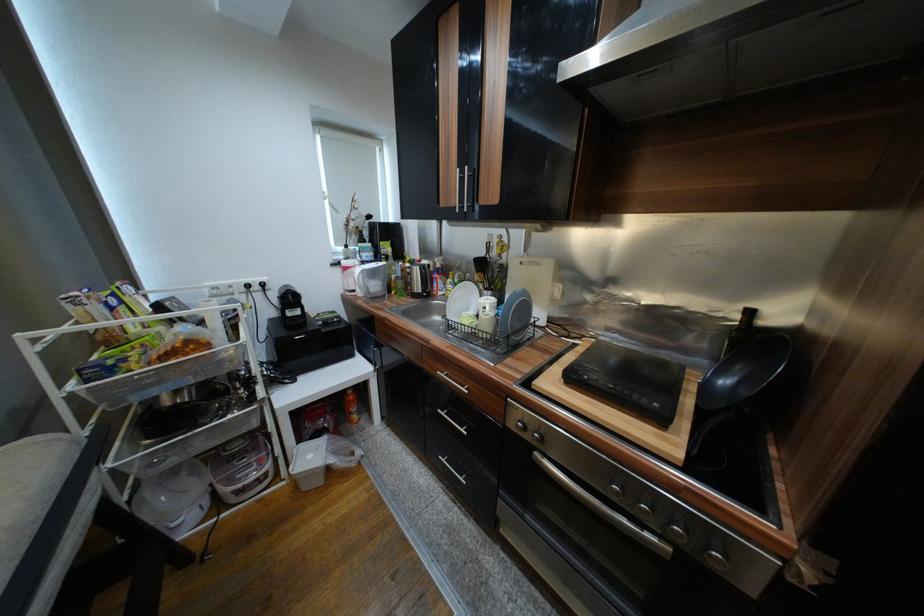
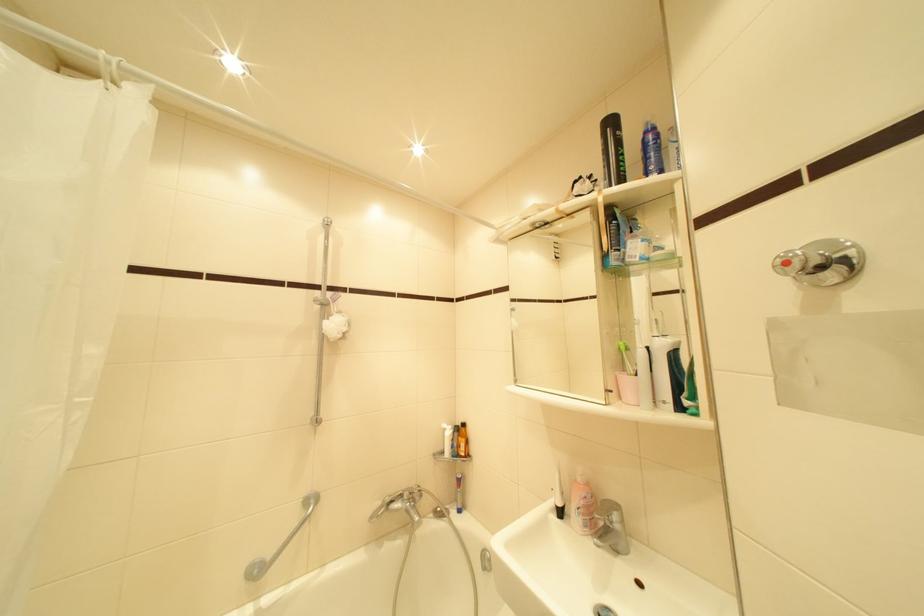
The images are taken continuously from a first-person perspective. In which direction are you moving?

The movement direction of the cameraman is right, backward.